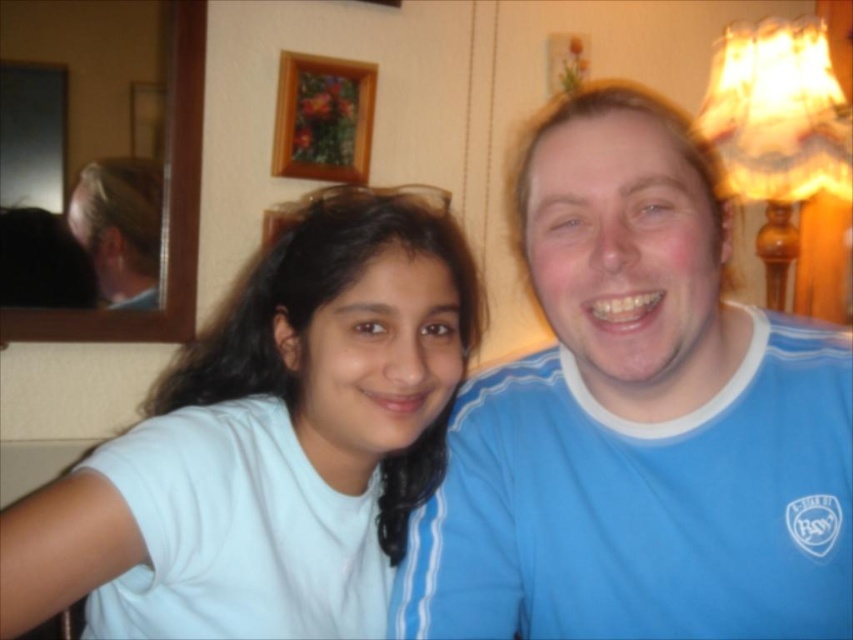
Is blue cotton shirt at right to the left of white matte t-shirt at left from the viewer's perspective?

In fact, blue cotton shirt at right is to the right of white matte t-shirt at left.

Is blue cotton shirt at right to the right of white matte t-shirt at left from the viewer's perspective?

Correct, you'll find blue cotton shirt at right to the right of white matte t-shirt at left.

Locate an element on the screen. The width and height of the screenshot is (853, 640). blue cotton shirt at right is located at coordinates tap(637, 419).

Locate an element on the screen. The width and height of the screenshot is (853, 640). blue cotton shirt at right is located at coordinates (637, 419).

Is point (361, 276) less distant than point (351, 173)?

That is True.

Is white matte t-shirt at left smaller than wooden picture frame at upper center?

Actually, white matte t-shirt at left might be larger than wooden picture frame at upper center.

What do you see at coordinates (350, 346) in the screenshot?
I see `white matte t-shirt at left` at bounding box center [350, 346].

The width and height of the screenshot is (853, 640). I want to click on white matte t-shirt at left, so click(x=350, y=346).

Consider the image. Can you confirm if wooden picture frame at upper center is positioned above blonde hair at left?

Correct, wooden picture frame at upper center is located above blonde hair at left.

Is wooden picture frame at upper center to the left of blonde hair at left from the viewer's perspective?

No, wooden picture frame at upper center is not to the left of blonde hair at left.

Describe the element at coordinates (323, 116) in the screenshot. This screenshot has height=640, width=853. I see `wooden picture frame at upper center` at that location.

At what (x,y) coordinates should I click in order to perform the action: click on wooden picture frame at upper center. Please return your answer as a coordinate pair (x, y). This screenshot has width=853, height=640. Looking at the image, I should click on (323, 116).